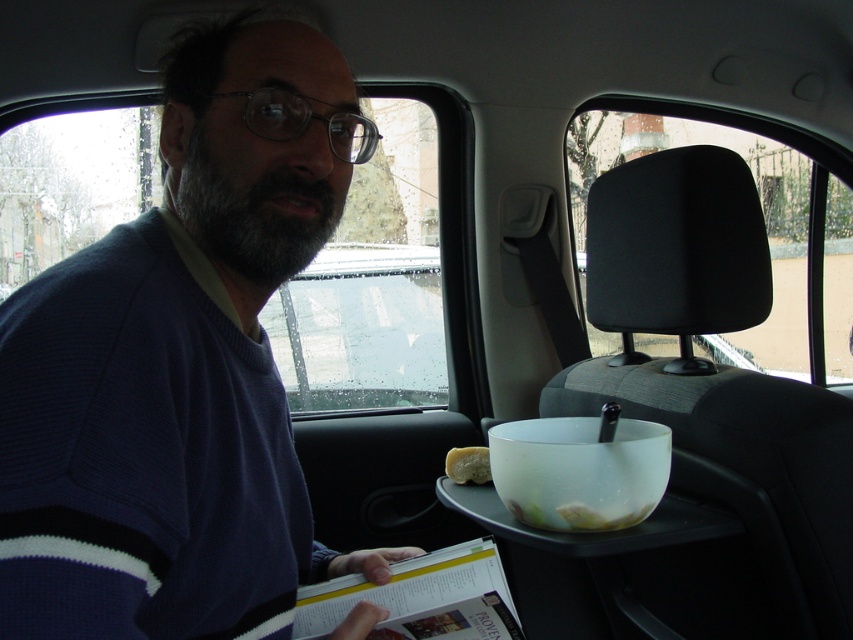
You are a passenger in the taxi and need to place your phone on the tray table. The dark blue sweater at left is currently on the seat. Is there enough space on the tray table to place your phone without moving the sweater?

The dark blue sweater at left is located at point (180, 365), which means it is not on the tray table but on the seat. Therefore, the tray table has enough space to place your phone without moving the sweater.

From the picture: You are sitting in the backseat of a taxi and want to place a small item on the tray table. The dark blue sweater at left is represented by point (180, 365). Where should you place the item to ensure it is closest to the dark blue sweater at left?

Place the item near the point (180, 365) on the tray table to ensure it is closest to the dark blue sweater at left.